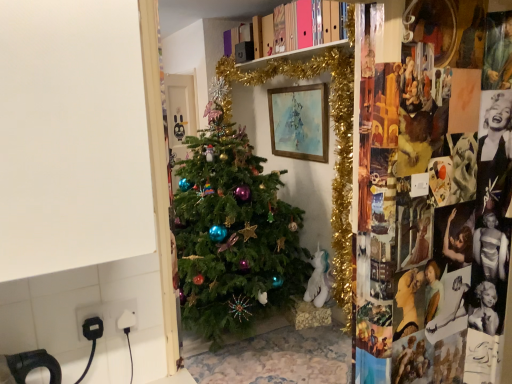
Question: Is white plastic plug at lower left next to watercolor paper painting at center?

Choices:
 (A) yes
 (B) no

Answer: (B)

Question: Is white plastic plug at lower left to the left of watercolor paper painting at center from the viewer's perspective?

Choices:
 (A) no
 (B) yes

Answer: (B)

Question: Are white plastic plug at lower left and watercolor paper painting at center far apart?

Choices:
 (A) no
 (B) yes

Answer: (B)

Question: Is white plastic plug at lower left to the right of watercolor paper painting at center from the viewer's perspective?

Choices:
 (A) no
 (B) yes

Answer: (A)

Question: Is white plastic plug at lower left positioned before watercolor paper painting at center?

Choices:
 (A) no
 (B) yes

Answer: (B)

Question: From the image's perspective, is white plastic plug at lower left located above watercolor paper painting at center?

Choices:
 (A) no
 (B) yes

Answer: (A)

Question: Does watercolor paper painting at center have a greater height compared to white plastic plug at lower left?

Choices:
 (A) yes
 (B) no

Answer: (A)

Question: Is watercolor paper painting at center looking in the opposite direction of white plastic plug at lower left?

Choices:
 (A) no
 (B) yes

Answer: (A)

Question: Would you say watercolor paper painting at center is a long distance from white plastic plug at lower left?

Choices:
 (A) yes
 (B) no

Answer: (A)

Question: From the image's perspective, is watercolor paper painting at center located beneath white plastic plug at lower left?

Choices:
 (A) yes
 (B) no

Answer: (B)

Question: From a real-world perspective, is watercolor paper painting at center physically below white plastic plug at lower left?

Choices:
 (A) no
 (B) yes

Answer: (A)

Question: Considering the relative positions of watercolor paper painting at center and white plastic plug at lower left in the image provided, is watercolor paper painting at center to the left of white plastic plug at lower left from the viewer's perspective?

Choices:
 (A) yes
 (B) no

Answer: (B)

Question: Considering the positions of white plastic plug at lower left and watercolor paper painting at center in the image, is white plastic plug at lower left wider or thinner than watercolor paper painting at center?

Choices:
 (A) wide
 (B) thin

Answer: (B)